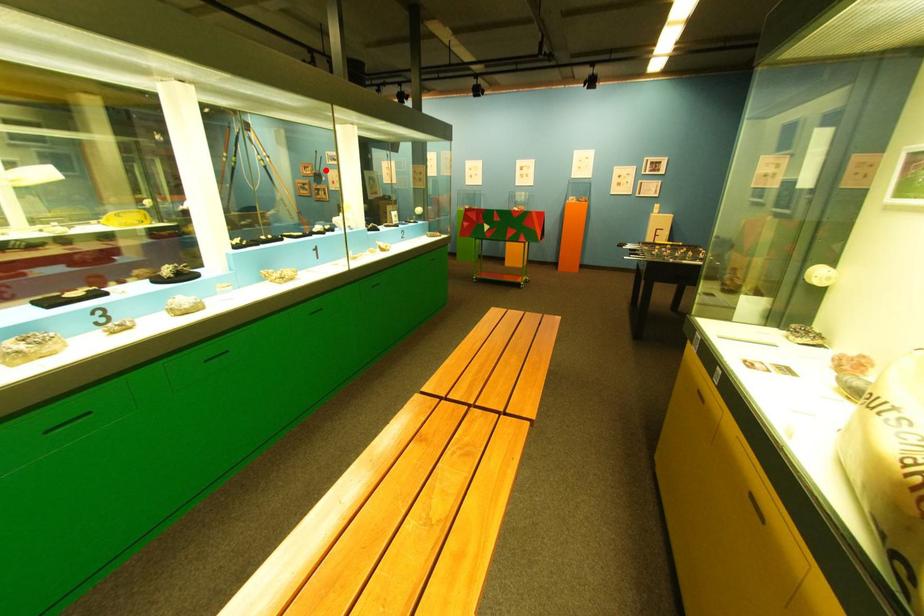
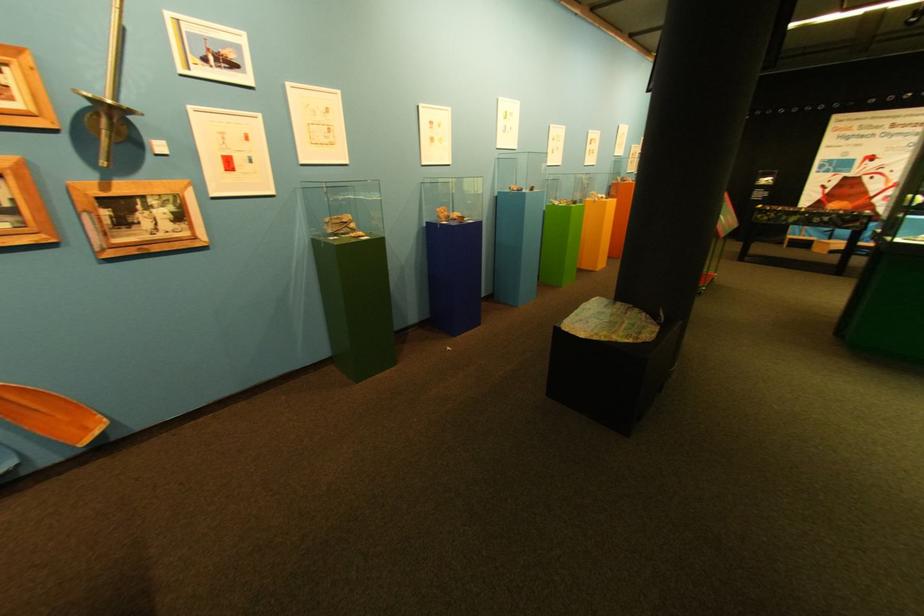
In the second image, find the point that corresponds to the highlighted location in the first image.

(22, 81)